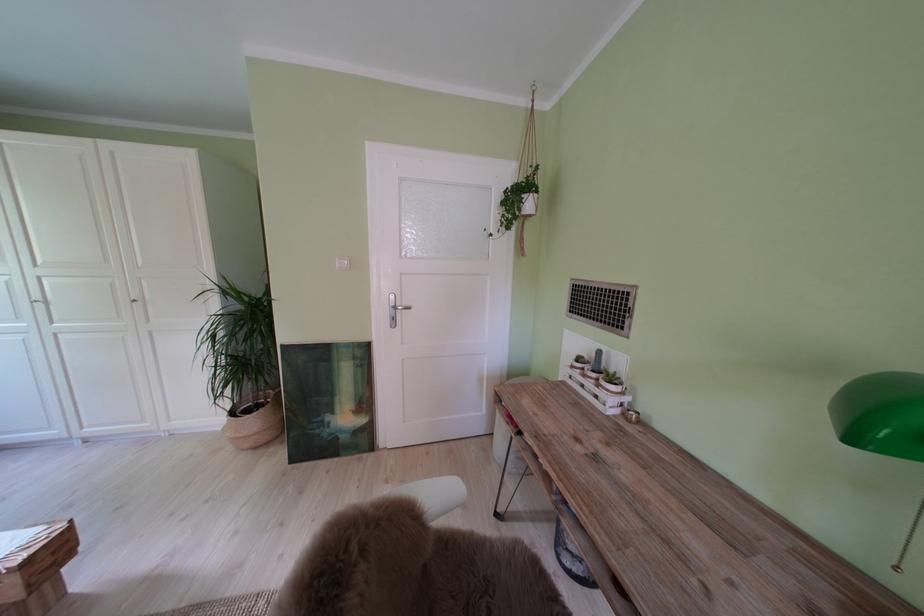
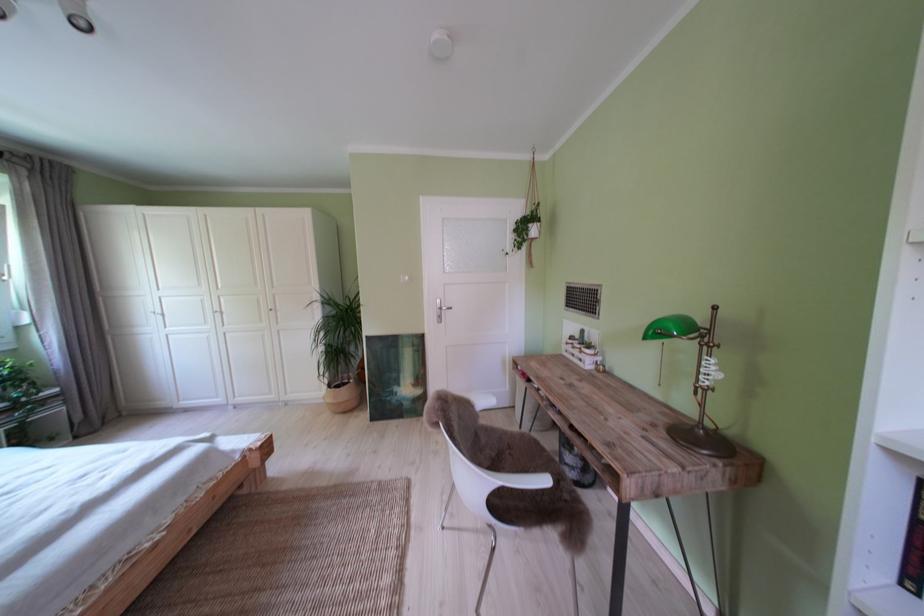
The point at (329,437) is marked in the first image. Where is the corresponding point in the second image?

(399, 403)